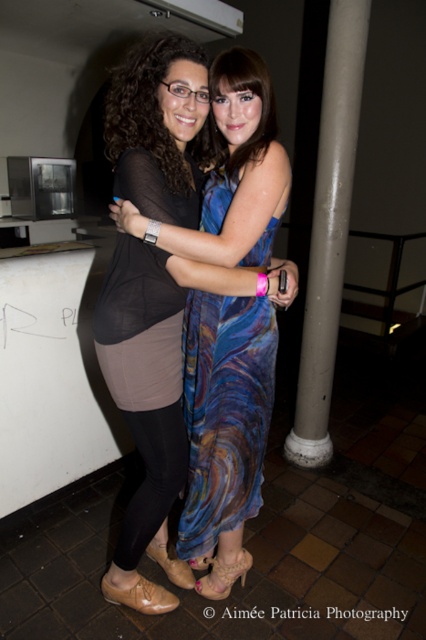
Question: Is swirl fabric dress at center to the left of blue textured dress at center from the viewer's perspective?

Choices:
 (A) no
 (B) yes

Answer: (A)

Question: Is gray concrete pillar at center closer to camera compared to shiny blue dress at center?

Choices:
 (A) yes
 (B) no

Answer: (B)

Question: Estimate the real-world distances between objects in this image. Which object is closer to the blue textured dress at center?

Choices:
 (A) swirl fabric dress at center
 (B) gray concrete pillar at center

Answer: (A)

Question: Which point is farther from the camera taking this photo?

Choices:
 (A) (181, 115)
 (B) (210, 468)

Answer: (B)

Question: Which point appears closest to the camera in this image?

Choices:
 (A) (115, 161)
 (B) (226, 493)
 (C) (180, 106)
 (D) (229, 168)

Answer: (C)

Question: Is matte black top at center positioned at the back of shiny blue dress at center?

Choices:
 (A) yes
 (B) no

Answer: (A)